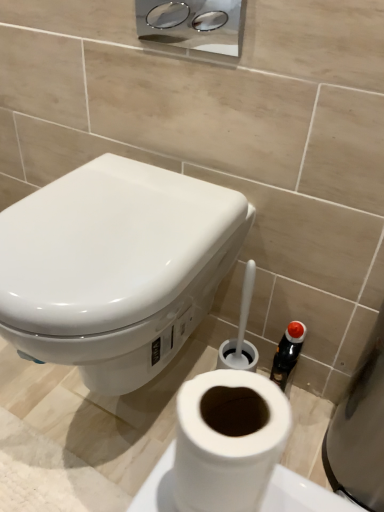
The width and height of the screenshot is (384, 512). I want to click on white matte toilet paper at lower center, so click(x=228, y=440).

In order to face chrome metallic dispenser at upper center, should I rotate leftwards or rightwards?

Rotate left and turn 0.551 degrees.

The width and height of the screenshot is (384, 512). Identify the location of white matte toilet paper at lower center. (228, 440).

Is point (173, 35) in front of point (132, 188)?

No, (173, 35) is further to viewer.

Measure the distance from chrome metallic dispenser at upper center to white glossy toilet at upper left.

chrome metallic dispenser at upper center and white glossy toilet at upper left are 49.81 centimeters apart.

Are chrome metallic dispenser at upper center and white glossy toilet at upper left far apart?

chrome metallic dispenser at upper center is actually quite close to white glossy toilet at upper left.

Looking at their sizes, would you say chrome metallic dispenser at upper center is wider or thinner than white glossy toilet at upper left?

Clearly, chrome metallic dispenser at upper center has less width compared to white glossy toilet at upper left.

Is white matte toilet paper at lower center facing away from white glossy toilet at upper left?

No, white glossy toilet at upper left is not at the back of white matte toilet paper at lower center.

Looking at this image, from a real-world perspective, is white matte toilet paper at lower center physically below white glossy toilet at upper left?

Actually, white matte toilet paper at lower center is physically above white glossy toilet at upper left in the real world.

Is white matte toilet paper at lower center bigger than white glossy toilet at upper left?

Incorrect, white matte toilet paper at lower center is not larger than white glossy toilet at upper left.

Is white matte toilet paper at lower center with white glossy toilet at upper left?

No, white matte toilet paper at lower center is not next to white glossy toilet at upper left.

Is white glossy toilet at upper left bigger or smaller than white matte toilet paper at lower center?

In the image, white glossy toilet at upper left appears to be larger than white matte toilet paper at lower center.

Looking at this image, between white glossy toilet at upper left and white matte toilet paper at lower center, which one has less height?

Standing shorter between the two is white matte toilet paper at lower center.

Which object is positioned more to the left, white glossy toilet at upper left or white matte toilet paper at lower center?

white glossy toilet at upper left is more to the left.

From the image's perspective, is white glossy toilet at upper left on white matte toilet paper at lower center?

Yes, from the image's perspective, white glossy toilet at upper left is over white matte toilet paper at lower center.

Between white matte toilet paper at lower center and chrome metallic dispenser at upper center, which one has less height?

Standing shorter between the two is white matte toilet paper at lower center.

From the picture: From the image's perspective, which one is positioned lower, white matte toilet paper at lower center or chrome metallic dispenser at upper center?

From the image's view, white matte toilet paper at lower center is below.

Which is behind, point (271, 395) or point (230, 42)?

The point (230, 42) is more distant.

Between white glossy toilet at upper left and chrome metallic dispenser at upper center, which one has smaller size?

With smaller size is chrome metallic dispenser at upper center.

Locate an element on the screen. dispenser on the right of white glossy toilet at upper left is located at coordinates (193, 24).

Could you tell me if white glossy toilet at upper left is turned towards chrome metallic dispenser at upper center?

No, white glossy toilet at upper left is not turned towards chrome metallic dispenser at upper center.

How much distance is there between chrome metallic dispenser at upper center and white matte toilet paper at lower center?

chrome metallic dispenser at upper center and white matte toilet paper at lower center are 3.59 feet apart from each other.

Considering the sizes of chrome metallic dispenser at upper center and white matte toilet paper at lower center in the image, is chrome metallic dispenser at upper center bigger or smaller than white matte toilet paper at lower center?

In the image, chrome metallic dispenser at upper center appears to be larger than white matte toilet paper at lower center.

Is chrome metallic dispenser at upper center turned away from white matte toilet paper at lower center?

No.

Considering the positions of point (169, 42) and point (244, 384), is point (169, 42) closer or farther from the camera than point (244, 384)?

Point (169, 42) appears to be farther away from the viewer than point (244, 384).

You are a GUI agent. You are given a task and a screenshot of the screen. Output one action in this format:
    pyautogui.click(x=<x>, y=<y>)
    Task: Click on the dispenser positioned vertically above the white glossy toilet at upper left (from a real-world perspective)
    
    Given the screenshot: What is the action you would take?
    pyautogui.click(x=193, y=24)

Find the location of a particular element. toilet that appears below the white matte toilet paper at lower center (from a real-world perspective) is located at coordinates pyautogui.click(x=115, y=267).

Based on the photo, based on their spatial positions, is white glossy toilet at upper left or white matte toilet paper at lower center further from chrome metallic dispenser at upper center?

white matte toilet paper at lower center.

Based on their spatial positions, is white matte toilet paper at lower center or chrome metallic dispenser at upper center closer to white glossy toilet at upper left?

The object closer to white glossy toilet at upper left is white matte toilet paper at lower center.

From the image, which object appears to be farther from chrome metallic dispenser at upper center, white matte toilet paper at lower center or white glossy toilet at upper left?

white matte toilet paper at lower center lies further to chrome metallic dispenser at upper center than the other object.

From the image, which object appears to be nearer to white matte toilet paper at lower center, chrome metallic dispenser at upper center or white glossy toilet at upper left?

The object closer to white matte toilet paper at lower center is white glossy toilet at upper left.

Looking at the image, which one is located further to white matte toilet paper at lower center, white glossy toilet at upper left or chrome metallic dispenser at upper center?

The object further to white matte toilet paper at lower center is chrome metallic dispenser at upper center.

Considering their positions, is chrome metallic dispenser at upper center positioned further to white glossy toilet at upper left than white matte toilet paper at lower center?

Based on the image, chrome metallic dispenser at upper center appears to be further to white glossy toilet at upper left.

Where is `toilet between chrome metallic dispenser at upper center and white matte toilet paper at lower center in the vertical direction`? This screenshot has width=384, height=512. toilet between chrome metallic dispenser at upper center and white matte toilet paper at lower center in the vertical direction is located at coordinates (115, 267).